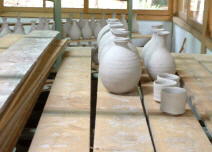
This screenshot has height=152, width=212. I want to click on white cups, so 176,104, 156,89, 170,76.